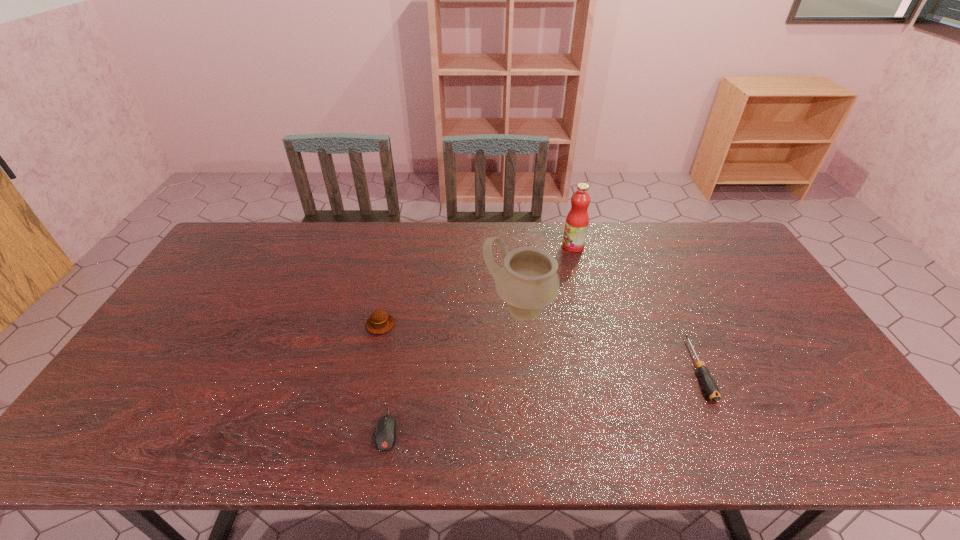
Find the location of a particular element. The width and height of the screenshot is (960, 540). free point between the screwdriver and the leftmost object is located at coordinates (540, 347).

This screenshot has width=960, height=540. I want to click on empty space that is in between the screwdriver and the fruit juice, so click(x=636, y=308).

The height and width of the screenshot is (540, 960). I want to click on vacant area between the third shortest object and the third object from left to right, so click(x=450, y=316).

This screenshot has width=960, height=540. I want to click on object that stands as the third closest to the muffin, so click(576, 225).

In order to click on object that stands as the fourth closest to the muffin in this screenshot , I will do `click(710, 386)`.

Identify the location of free space that satisfies the following two spatial constraints: 1. on the front label of the second object from right to left; 2. on the right side of the screwdriver. (606, 369).

Where is `vacant region that satisfies the following two spatial constraints: 1. on the front label of the farthest object; 2. on the front side of the nearest object`? vacant region that satisfies the following two spatial constraints: 1. on the front label of the farthest object; 2. on the front side of the nearest object is located at coordinates (621, 429).

Image resolution: width=960 pixels, height=540 pixels. I want to click on vacant space that satisfies the following two spatial constraints: 1. on the front label of the rightmost object; 2. on the right side of the farthest object, so click(606, 369).